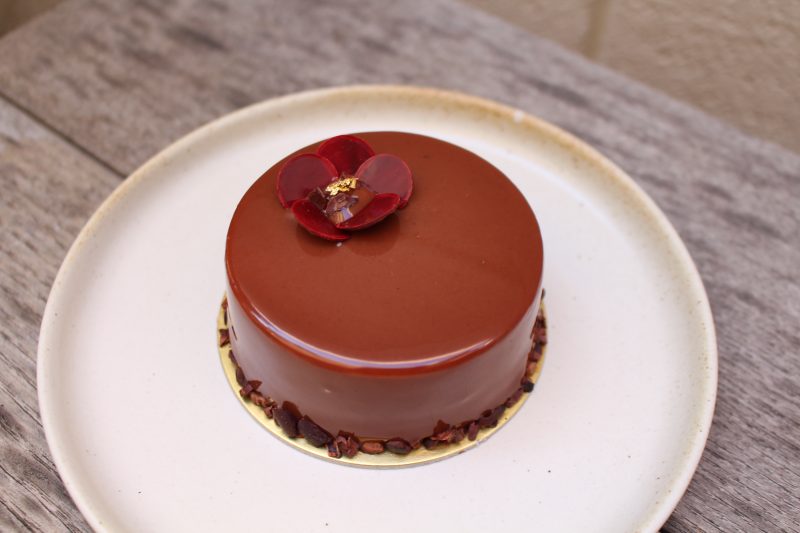
In order to click on empty space beside the table in this screenshot , I will do `click(718, 55)`.